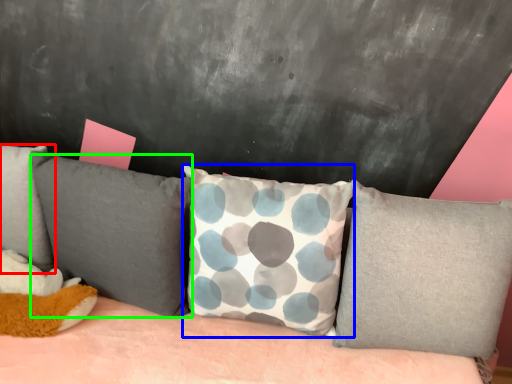
Question: Considering the real-world distances, which object is closest to pillow (highlighted by a red box)? pillow (highlighted by a blue box) or pillow (highlighted by a green box).

Choices:
 (A) pillow
 (B) pillow

Answer: (B)